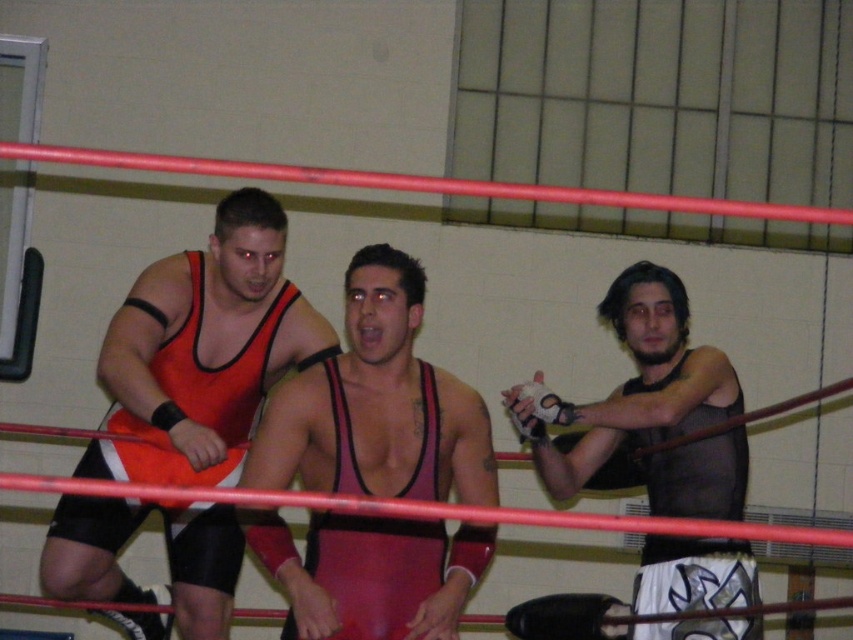
Question: Does shiny red singlet at center have a lesser width compared to black mesh tank top at right?

Choices:
 (A) yes
 (B) no

Answer: (A)

Question: Can you confirm if shiny red singlet at center is positioned to the left of black mesh tank top at right?

Choices:
 (A) no
 (B) yes

Answer: (B)

Question: Is shiny red singlet at center wider than black mesh tank top at right?

Choices:
 (A) yes
 (B) no

Answer: (B)

Question: Which point is closer to the camera?

Choices:
 (A) (209, 435)
 (B) (408, 628)

Answer: (B)

Question: Which of the following is the closest to the observer?

Choices:
 (A) (622, 314)
 (B) (412, 280)

Answer: (B)

Question: Which is farther from the shiny red singlet at center?

Choices:
 (A) matte orange singlet at center
 (B) black mesh tank top at right

Answer: (B)